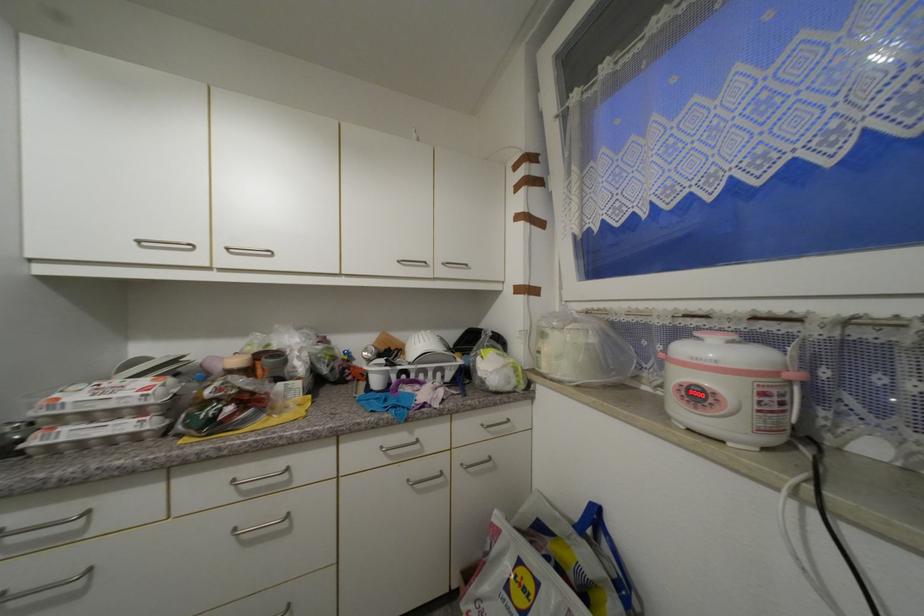
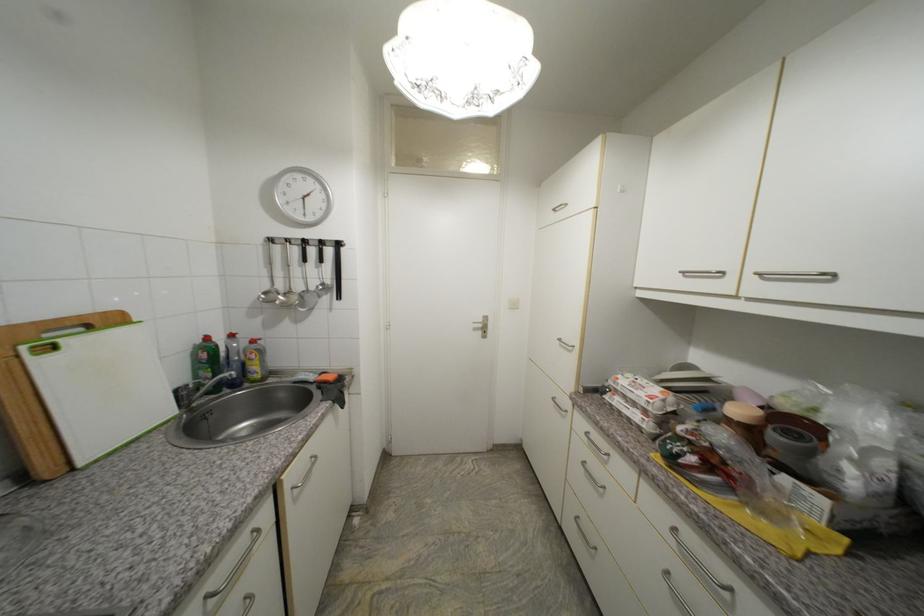
Find the pixel in the second image that matches (253,373) in the first image.

(756, 432)